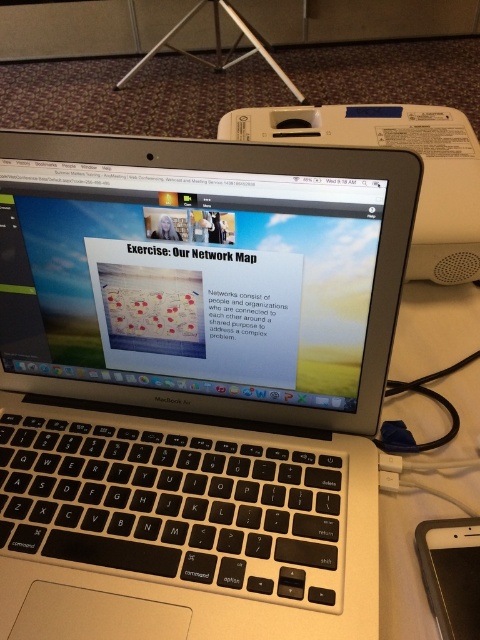
You are organizing a tech fair and need to arrange the satin silver laptop at center and the black plastic ipad at lower right on a table. If the table has a width of 1.2 meters, and the distance between the two devices must be at least 0.3 meters for visibility, can both devices fit side by side without overlapping?

The satin silver laptop at center is wider than the black plastic ipad at lower right. To determine if they can fit side by side, we need to know their exact widths. However, since the laptop is wider, the total required space would be the sum of both widths plus the 0.3 meters gap. Without specific measurements, it is impossible to confirm if they fit within 1.2 meters. Additional information about their individual dimensions is needed to make an accurate assessment.

You are a student trying to locate a specific point on the laptop screen. The point you need to find is point (189, 280). According to the image, where exactly is this point located?

The point (189, 280) is located on the satin silver laptop at center.

Consider the image. You are organizing a tech conference and need to place a white plastic speaker at upper right and a black plastic ipad at lower right on a table. If the table has limited space, which object should you prioritize placing first to ensure it fits?

The white plastic speaker at upper right has a larger width than the black plastic ipad at lower right, so you should prioritize placing the white plastic speaker at upper right first to ensure it fits on the table.